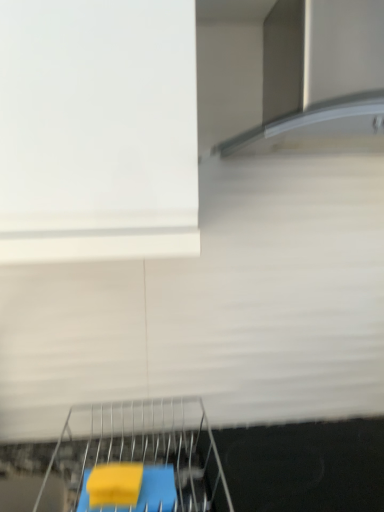
Question: From the image's perspective, does satin silver exhaust hood at upper center appear higher than metal wire rack at lower center?

Choices:
 (A) yes
 (B) no

Answer: (A)

Question: Is satin silver exhaust hood at upper center closer to camera compared to metal wire rack at lower center?

Choices:
 (A) no
 (B) yes

Answer: (B)

Question: Is metal wire rack at lower center at the back of satin silver exhaust hood at upper center?

Choices:
 (A) no
 (B) yes

Answer: (A)

Question: Can you confirm if satin silver exhaust hood at upper center is wider than metal wire rack at lower center?

Choices:
 (A) no
 (B) yes

Answer: (A)

Question: From the image's perspective, would you say satin silver exhaust hood at upper center is shown under metal wire rack at lower center?

Choices:
 (A) yes
 (B) no

Answer: (B)

Question: Does satin silver exhaust hood at upper center have a lesser height compared to metal wire rack at lower center?

Choices:
 (A) no
 (B) yes

Answer: (A)

Question: Can you confirm if metal wire rack at lower center is positioned to the left of satin silver exhaust hood at upper center?

Choices:
 (A) yes
 (B) no

Answer: (A)

Question: From a real-world perspective, is metal wire rack at lower center below satin silver exhaust hood at upper center?

Choices:
 (A) yes
 (B) no

Answer: (A)

Question: Is satin silver exhaust hood at upper center a part of metal wire rack at lower center?

Choices:
 (A) yes
 (B) no

Answer: (B)

Question: Is metal wire rack at lower center shorter than satin silver exhaust hood at upper center?

Choices:
 (A) yes
 (B) no

Answer: (A)

Question: Can you confirm if metal wire rack at lower center is wider than satin silver exhaust hood at upper center?

Choices:
 (A) yes
 (B) no

Answer: (A)

Question: Would you say metal wire rack at lower center is outside satin silver exhaust hood at upper center?

Choices:
 (A) yes
 (B) no

Answer: (A)

Question: From a real-world perspective, is satin silver exhaust hood at upper center above or below metal wire rack at lower center?

Choices:
 (A) above
 (B) below

Answer: (A)